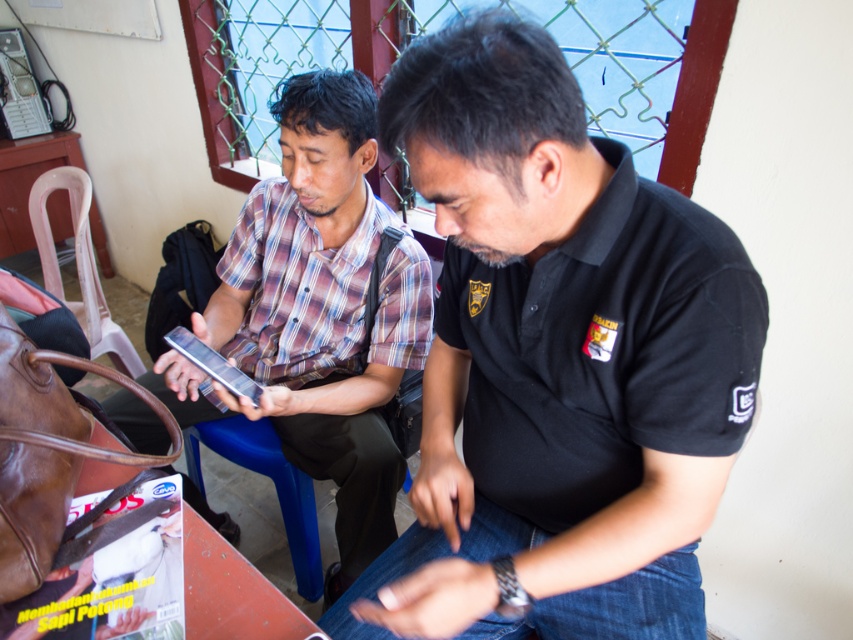
You are a photographer trying to capture a closeup of the metallic silver phone at center without including the black matte shirt at center in the frame. Given their sizes, is this possible?

The black matte shirt at center is bigger than metallic silver phone at center, so it might be challenging to frame the metallic silver phone at center without including the black matte shirt at center due to its larger size.

You are a delivery robot with a 20 inch wide package. You need to pass between the black matte shirt at center and the plaid shirt at center. Can you fit through the space between them?

The black matte shirt at center is 19.41 inches away from the plaid shirt at center. Since the package is 20 inches wide, it is slightly wider than the available space of 19.41 inches, so the package cannot fit through the space between them.